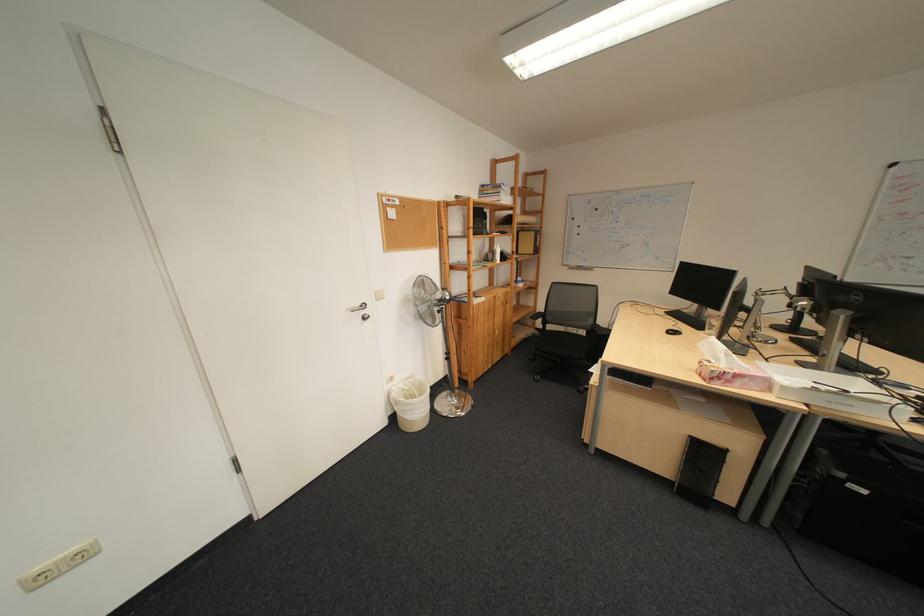
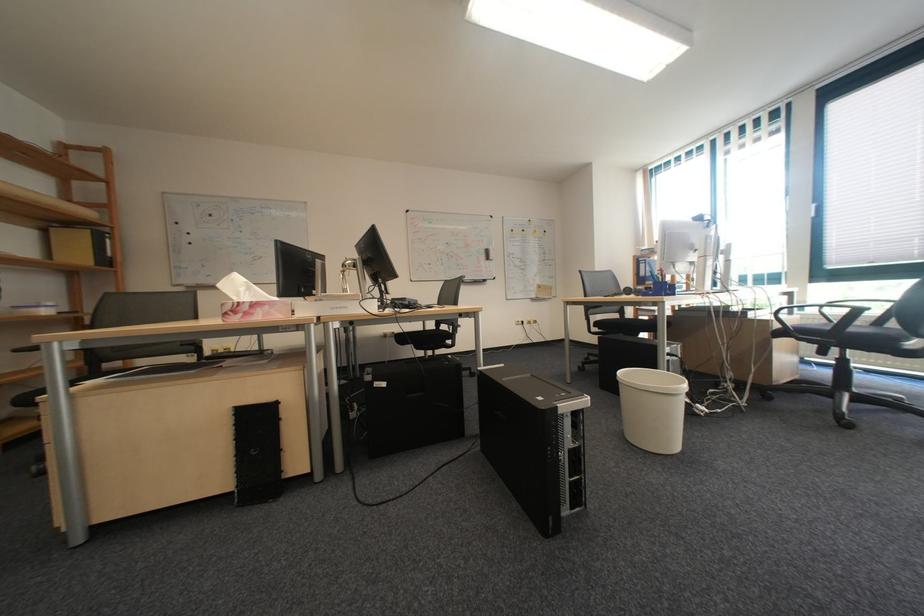
Find the pixel in the second image that matches point (548, 233) in the first image.

(103, 232)